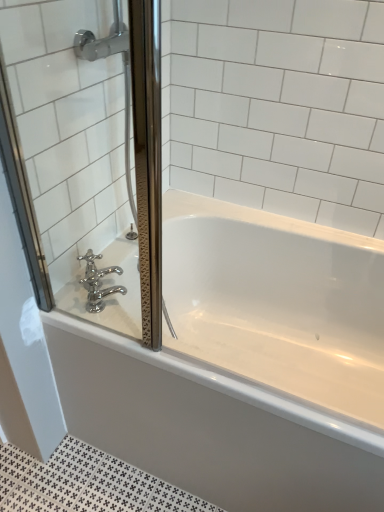
The height and width of the screenshot is (512, 384). Identify the location of free area below clear glass screen door at left (from a real-world perspective). (99, 323).